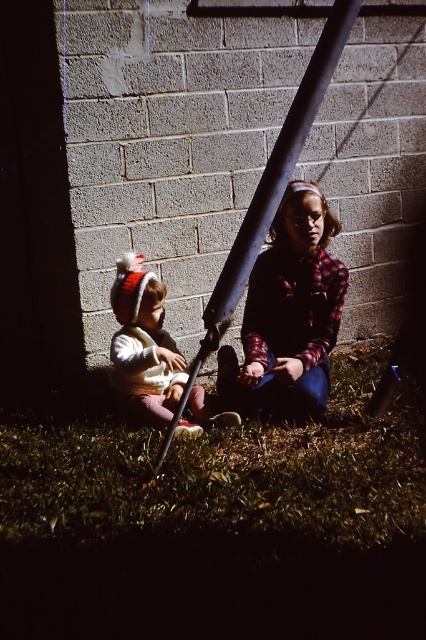
Can you confirm if green grass at lower center is bigger than white woolen hat at left?

Yes.

Based on the photo, can you confirm if green grass at lower center is thinner than white woolen hat at left?

No.

The image size is (426, 640). I want to click on green grass at lower center, so click(x=226, y=472).

Which of these two, green grass at lower center or metallic pole at center, stands taller?

metallic pole at center is taller.

Is point (353, 515) positioned after point (210, 305)?

No, (353, 515) is closer to viewer.

What are the coordinates of `green grass at lower center` in the screenshot? It's located at coord(226,472).

Who is shorter, plaid shirt at center or metallic pole at center?

With less height is plaid shirt at center.

Measure the distance from plaid shirt at center to metallic pole at center.

plaid shirt at center is 26.72 inches from metallic pole at center.

At what (x,y) coordinates should I click in order to perform the action: click on plaid shirt at center. Please return your answer as a coordinate pair (x, y). This screenshot has height=640, width=426. Looking at the image, I should click on [x=288, y=316].